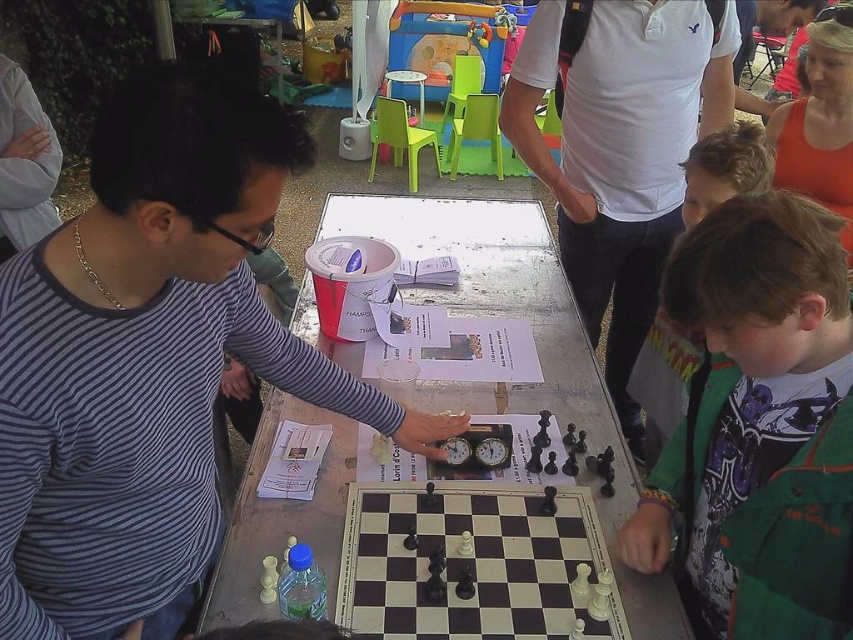
Which is behind, point (122, 259) or point (405, 604)?

The point (405, 604) is more distant.

Is point (48, 412) closer to camera compared to point (503, 512)?

That is True.

Find the location of a particular element. striped cotton shirt at left is located at coordinates (148, 356).

Who is lower down, striped cotton shirt at left or green textured jacket at lower right?

green textured jacket at lower right is lower down.

From the picture: Who is positioned more to the left, striped cotton shirt at left or green textured jacket at lower right?

striped cotton shirt at left

Consider the image. Who is more forward, (x=80, y=248) or (x=790, y=589)?

Point (x=80, y=248)

Image resolution: width=853 pixels, height=640 pixels. I want to click on striped cotton shirt at left, so click(148, 356).

Is wooden chessboard at center closer to camera compared to green fleece jacket at right?

That is True.

Is wooden chessboard at center shorter than green fleece jacket at right?

Indeed, wooden chessboard at center has a lesser height compared to green fleece jacket at right.

Is point (428, 568) less distant than point (646, 442)?

Yes.

Where is `wooden chessboard at center`? This screenshot has width=853, height=640. wooden chessboard at center is located at coordinates (474, 564).